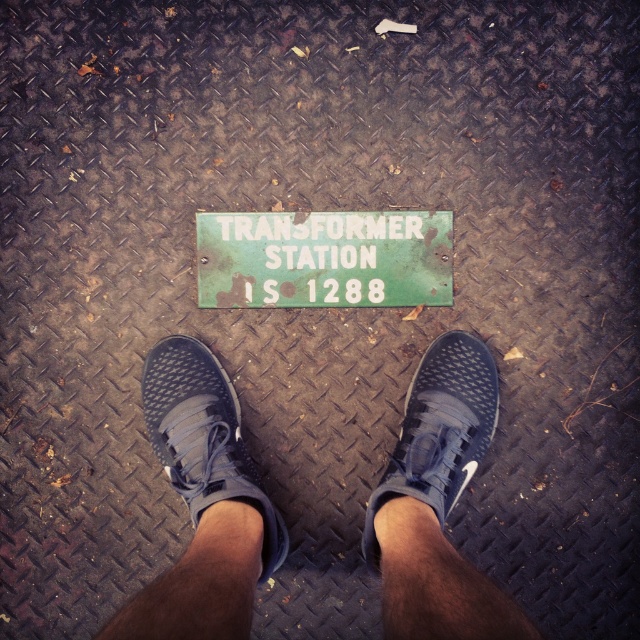
You are a delivery person who needs to place a small package exactly between the blue mesh sneakers at center and the green rusted sign at center. How far apart should you position the package from each object to ensure it is centered?

The blue mesh sneakers at center and green rusted sign at center are 9.57 inches apart. To place the package exactly between them, position it 4.785 inches away from each object.

You are a delivery person who needs to place a small package between the blue mesh sneakers at center and the black mesh shoe at center. Can you fit the package there if it requires a space taller than the taller object?

The blue mesh sneakers at center is taller than the black mesh shoe at center. Therefore, the required space must be taller than the blue mesh sneakers at center. Without knowing the exact height of the package, it is impossible to determine if it will fit.

You are a delivery person who needs to place a small package exactly where the blue mesh sneakers at center and the black mesh shoe at center are currently standing. Since you can only place the package in the space between them, can you fit it there?

The blue mesh sneakers at center are to the left of the black mesh shoe at center, so there is space between them. However, the exact width of the space isn not specified, so it is uncertain if the package will fit.